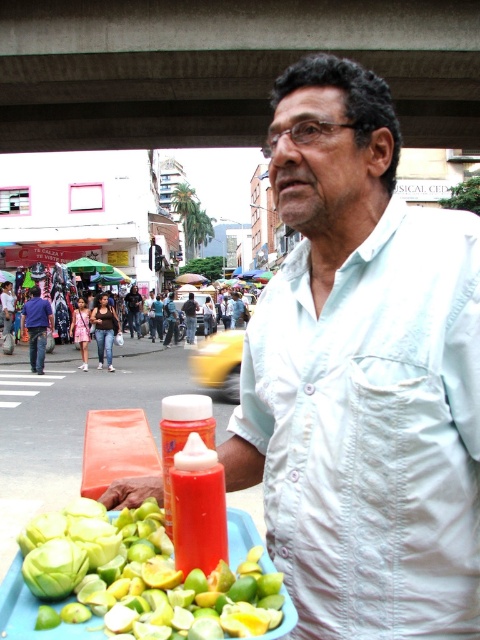
You are a customer at this market stall and want to place a small spoon between the green matte fruit at lower left and the green matte cabbage at lower left. The spoon is 3 inches long. Will there be enough space between them to fit the spoon?

The green matte fruit at lower left is 5.51 inches from green matte cabbage at lower left. Since the spoon is only 3 inches long, there is enough space between them to fit the spoon.

You are a customer at the market and want to buy a lime. The vendor is standing behind the tray with the fruits. Where is the white cotton shirt at center in relation to the tray?

The white cotton shirt at center is located at point (362, 376), which is behind the tray containing the sliced green limes, whole green limes, and the bright red bottle with a white cap.